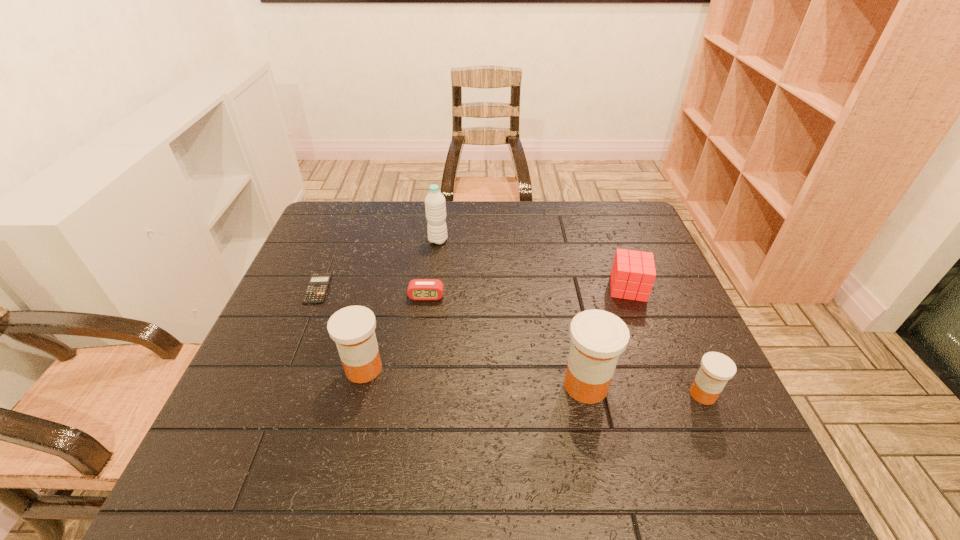
Identify the location of medicine that is positioned at the right edge. The height and width of the screenshot is (540, 960). (716, 369).

Find the location of `cube located at the right edge`. cube located at the right edge is located at coordinates (633, 273).

Locate an element on the screen. Image resolution: width=960 pixels, height=540 pixels. object that is at the near right corner is located at coordinates (716, 369).

In the image, there is a desktop. In order to click on vacant space at the far edge in this screenshot , I will do `click(458, 239)`.

In the image, there is a desktop. In order to click on free region at the near edge in this screenshot , I will do `click(398, 415)`.

This screenshot has height=540, width=960. What are the coordinates of `vacant space at the left edge of the desktop` in the screenshot? It's located at (309, 367).

Where is `vacant area at the right edge`? The image size is (960, 540). vacant area at the right edge is located at coordinates (623, 248).

In the image, there is a desktop. Identify the location of free space at the near left corner. This screenshot has height=540, width=960. (280, 422).

Where is `free space at the near right corner of the desktop`? The width and height of the screenshot is (960, 540). free space at the near right corner of the desktop is located at coordinates (741, 421).

The height and width of the screenshot is (540, 960). What are the coordinates of `free space between the water bottle and the shortest object` in the screenshot? It's located at (377, 265).